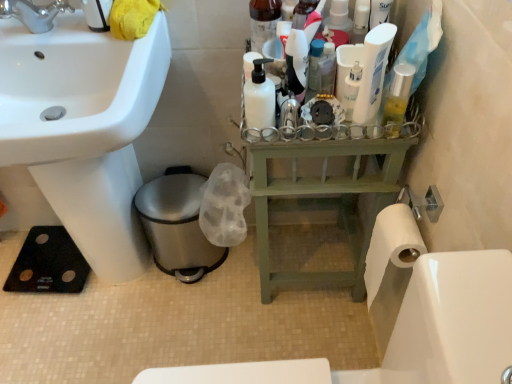
Question: Can you confirm if matte black bottle at center, the second toiletry in the right-to-left sequence, is taller than black rubber mat at lower left?

Choices:
 (A) yes
 (B) no

Answer: (B)

Question: Is matte black bottle at center, arranged as the second toiletry when viewed from the left, in contact with black rubber mat at lower left?

Choices:
 (A) no
 (B) yes

Answer: (A)

Question: Is matte black bottle at center, arranged as the second toiletry when viewed from the left, looking in the opposite direction of black rubber mat at lower left?

Choices:
 (A) no
 (B) yes

Answer: (A)

Question: Can you confirm if matte black bottle at center, arranged as the second toiletry when viewed from the left, is wider than black rubber mat at lower left?

Choices:
 (A) no
 (B) yes

Answer: (A)

Question: Considering the positions of point (249, 3) and point (349, 100), is point (249, 3) closer or farther from the camera than point (349, 100)?

Choices:
 (A) closer
 (B) farther

Answer: (B)

Question: From their relative heights in the image, would you say translucent plastic pump bottle at upper center, positioned as the first toiletry in left-to-right order, is taller or shorter than white glossy lotion at center, which is the 3th toiletry in left-to-right order?

Choices:
 (A) tall
 (B) short

Answer: (A)

Question: In terms of size, does translucent plastic pump bottle at upper center, which appears as the third toiletry when viewed from the right, appear bigger or smaller than white glossy lotion at center, marked as the 1th toiletry in a right-to-left arrangement?

Choices:
 (A) big
 (B) small

Answer: (A)

Question: In terms of width, does translucent plastic pump bottle at upper center, positioned as the first toiletry in left-to-right order, look wider or thinner when compared to white glossy lotion at center, which is the 3th toiletry in left-to-right order?

Choices:
 (A) thin
 (B) wide

Answer: (B)

Question: From the image's perspective, is black rubber mat at lower left positioned above or below green wood balustrade at center?

Choices:
 (A) above
 (B) below

Answer: (B)

Question: Relative to green wood balustrade at center, is black rubber mat at lower left in front or behind?

Choices:
 (A) front
 (B) behind

Answer: (A)

Question: From a real-world perspective, is black rubber mat at lower left positioned above or below green wood balustrade at center?

Choices:
 (A) above
 (B) below

Answer: (A)

Question: Is black rubber mat at lower left to the left or to the right of green wood balustrade at center in the image?

Choices:
 (A) left
 (B) right

Answer: (A)

Question: Is point (246, 86) positioned closer to the camera than point (344, 81)?

Choices:
 (A) closer
 (B) farther

Answer: (A)

Question: In the image, is white matte bottle at center positioned in front of or behind white glossy lotion at center, which is the 3th toiletry in left-to-right order?

Choices:
 (A) behind
 (B) front

Answer: (B)